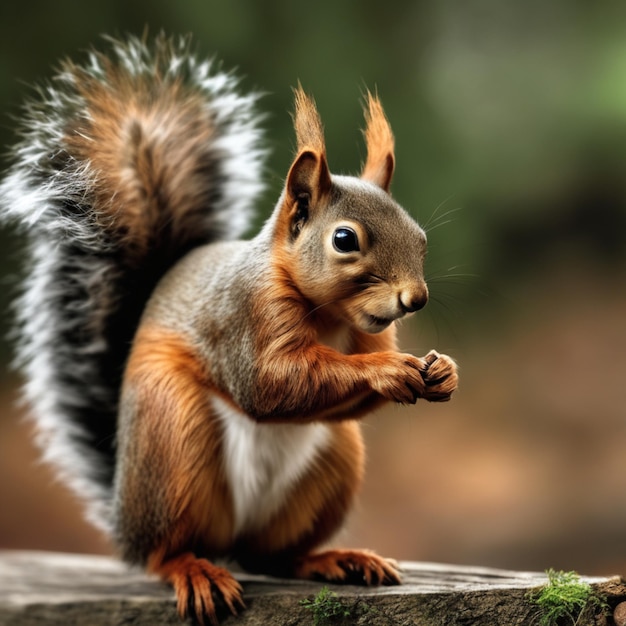
What are the coordinates of `chest` in the screenshot? It's located at (273, 431).